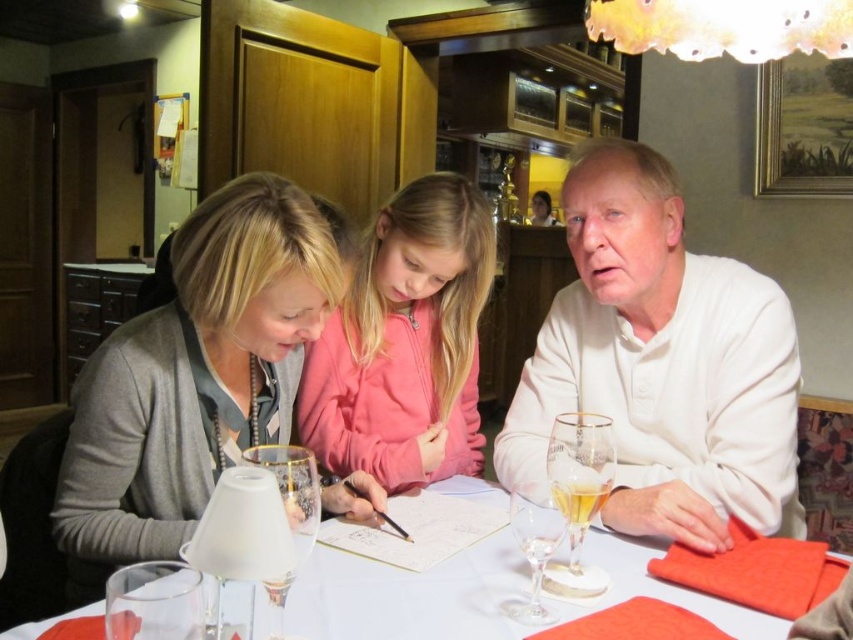
You are a server in a restaurant and need to place a new menu on the table. The menu is 15 inches wide. There is a pink fleece jacket at center and a white paper at center on the table. Can the menu fit between them without overlapping?

The pink fleece jacket at center is narrower than the white paper at center. However, since the exact distance between them isn not specified, we cannot determine if the 15 inch menu will fit. Please check the space between them.

You are a waiter carrying a tray of drinks and need to place them at point (346, 413). The tray is 1.2 meters wide. Is there enough space between you and the point to safely place the tray without hitting anything?

The distance between you and point (346, 413) is 1.53 meters. Since the tray is 1.2 meters wide, there is sufficient space to safely place the tray without obstruction.

You are a waiter in a restaurant. You need to place a new order of a small salad plate between the matte gray sweater at left and the translucent glass beer at right. Can you fit the plate there without moving either object?

The matte gray sweater at left is above the translucent glass beer at right, so there is space between them horizontally. The salad plate can be placed between them as long as it fits within the available horizontal space on the table.